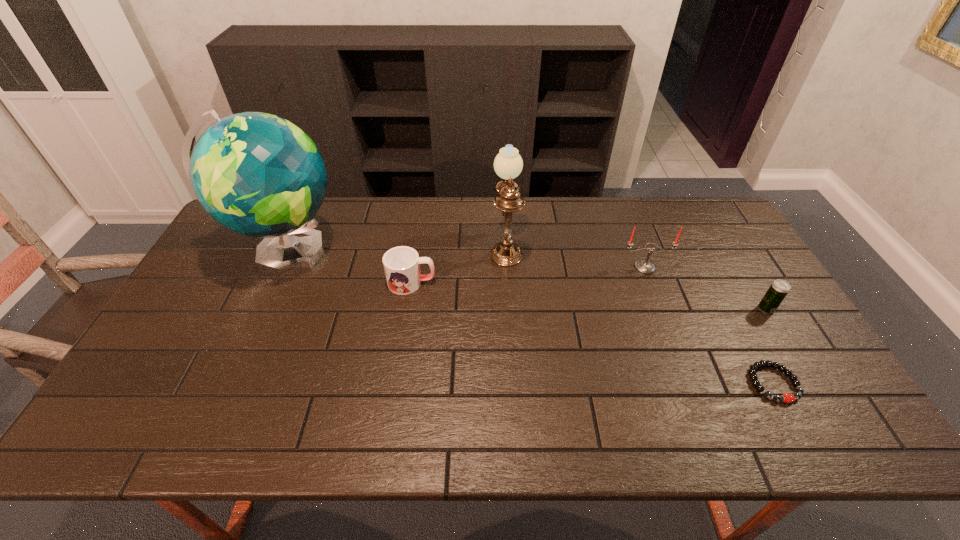
The width and height of the screenshot is (960, 540). In order to click on free spot between the mug and the fifth shortest object in this screenshot , I will do `click(459, 264)`.

The height and width of the screenshot is (540, 960). In order to click on free space between the leftmost object and the beer can in this screenshot , I will do `click(526, 281)`.

Locate an element on the screen. blank region between the tallest object and the mug is located at coordinates (349, 268).

The width and height of the screenshot is (960, 540). I want to click on free spot between the second object from left to right and the fourth object from left to right, so click(528, 275).

Locate an element on the screen. vacant area that lies between the fifth farthest object and the oil lamp is located at coordinates (636, 277).

You are a GUI agent. You are given a task and a screenshot of the screen. Output one action in this format:
    pyautogui.click(x=<x>, y=<y>)
    Task: Click on the empty space that is in between the second tallest object and the bracelet
    
    Given the screenshot: What is the action you would take?
    pyautogui.click(x=639, y=314)

Where is `free space between the third object from left to right and the fourth object from left to right`? This screenshot has height=540, width=960. free space between the third object from left to right and the fourth object from left to right is located at coordinates (575, 256).

Find the location of a particular element. free space between the rightmost object and the second tallest object is located at coordinates (636, 277).

What are the coordinates of `the fourth closest object to the rightmost object` in the screenshot? It's located at (401, 264).

Identify the location of object that is the fifth closest to the candle. The width and height of the screenshot is (960, 540). (257, 174).